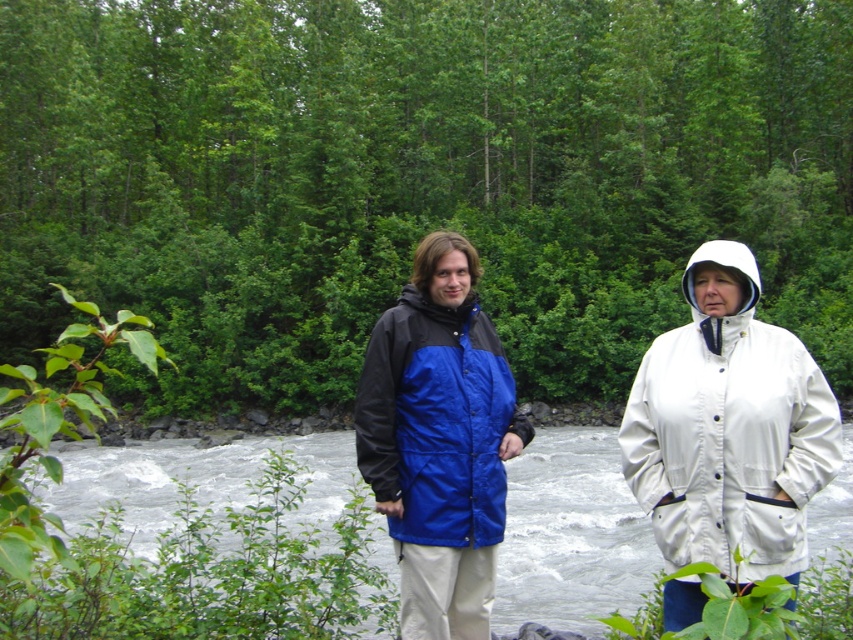
Who is lower down, white waterproof jacket at center or blue/black jacket at center?

blue/black jacket at center

Is white waterproof jacket at center below blue/black jacket at center?

Incorrect, white waterproof jacket at center is not positioned below blue/black jacket at center.

Is point (625, 460) more distant than point (440, 243)?

That is False.

Locate an element on the screen. The width and height of the screenshot is (853, 640). white waterproof jacket at center is located at coordinates (729, 428).

Between white water at river center and blue/black jacket at center, which one appears on the left side from the viewer's perspective?

Positioned to the left is white water at river center.

Between point (547, 579) and point (489, 328), which one is positioned behind?

Positioned behind is point (547, 579).

Where is `white water at river center`? This screenshot has height=640, width=853. white water at river center is located at coordinates (222, 566).

Does blue/white waterproof jacket at center appear on the right side of white water at river center?

Indeed, blue/white waterproof jacket at center is positioned on the right side of white water at river center.

Locate an element on the screen. The image size is (853, 640). blue/white waterproof jacket at center is located at coordinates (439, 440).